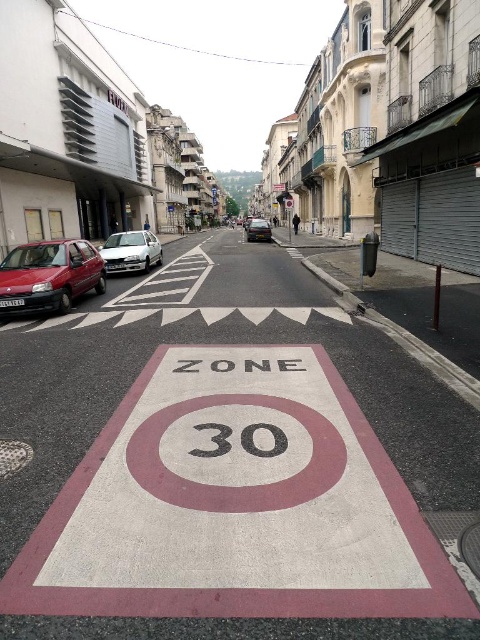
You are a cyclist planning to ride through the white concrete bike lane at center. There is a white metallic car at left parked nearby. Is the bike lane accessible for riding?

The white concrete bike lane at center is positioned under the white metallic car at left, which means the car is parked over the bike lane, making it inaccessible for riding.

You are a pedestrian standing at the edge of the street and want to cross to the other side. You see the matte red car at left and the white metallic car at left. Which car is shorter in height?

The matte red car at left has a lesser height compared to the white metallic car at left, so the matte red car at left is shorter in height.